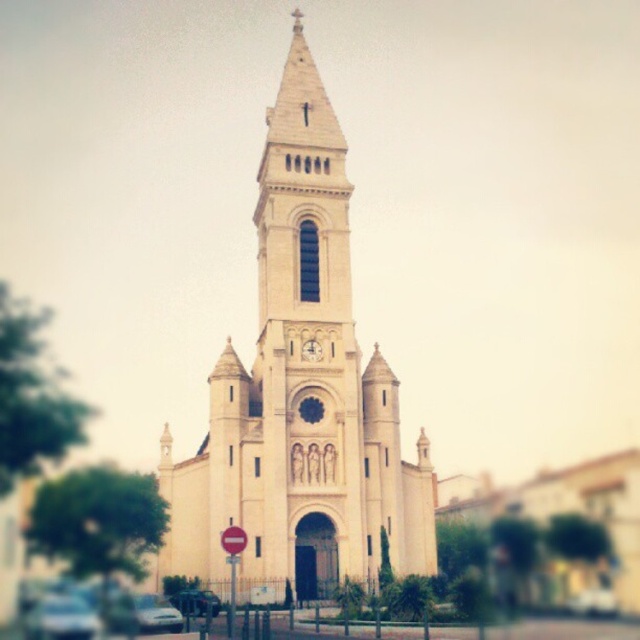
Is metallic silver car at lower left further to camera compared to gold metallic clock at center?

That is False.

Is metallic silver car at lower left smaller than gold metallic clock at center?

Actually, metallic silver car at lower left might be larger than gold metallic clock at center.

Does point (90, 611) lie in front of point (316, 355)?

Yes, point (90, 611) is in front of point (316, 355).

Where is `metallic silver car at lower left`? This screenshot has height=640, width=640. metallic silver car at lower left is located at coordinates (61, 618).

Is point (268, 580) positioned after point (180, 621)?

Yes, point (268, 580) is farther from viewer.

Which of these two, white stone church at center or white glossy car at lower left, stands shorter?

Standing shorter between the two is white glossy car at lower left.

At what (x,y) coordinates should I click in order to perform the action: click on white stone church at center. Please return your answer as a coordinate pair (x, y). The width and height of the screenshot is (640, 640). Looking at the image, I should click on pos(300,394).

Identify the location of white stone church at center. This screenshot has height=640, width=640. (300, 394).

Who is more distant from viewer, (189, 474) or (77, 637)?

Point (189, 474)

Can you confirm if white stone church at center is smaller than metallic silver car at lower left?

Incorrect, white stone church at center is not smaller in size than metallic silver car at lower left.

Which is in front, point (332, 228) or point (52, 596)?

Positioned in front is point (52, 596).

Identify the location of white stone church at center. (x=300, y=394).